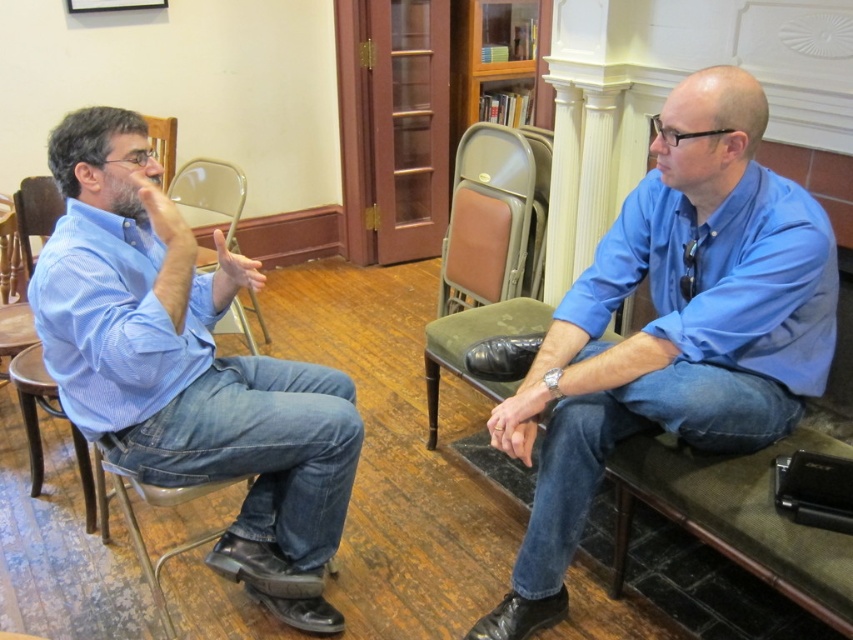
At what (x,y) coordinates should I click in order to perform the action: click on tan leather chair at center. Please return your answer as a coordinate pair (x, y). This screenshot has width=853, height=640. Looking at the image, I should click on (488, 218).

Looking at this image, who is more forward, (454, 256) or (184, 172)?

Point (454, 256)

This screenshot has width=853, height=640. Find the location of `tan leather chair at center`. tan leather chair at center is located at coordinates (488, 218).

Between blue cotton shirt at right and blue striped shirt at left, which one has less height?

Standing shorter between the two is blue striped shirt at left.

Can you confirm if blue cotton shirt at right is smaller than blue striped shirt at left?

Correct, blue cotton shirt at right occupies less space than blue striped shirt at left.

Identify the location of blue cotton shirt at right. This screenshot has height=640, width=853. (672, 328).

Image resolution: width=853 pixels, height=640 pixels. Describe the element at coordinates (187, 369) in the screenshot. I see `blue striped shirt at left` at that location.

Does blue striped shirt at left have a lesser width compared to tan leather chair at center?

No, blue striped shirt at left is not thinner than tan leather chair at center.

In the scene shown: Who is more forward, (322, 499) or (496, 131)?

Point (322, 499) is more forward.

Locate an element on the screen. blue striped shirt at left is located at coordinates (187, 369).